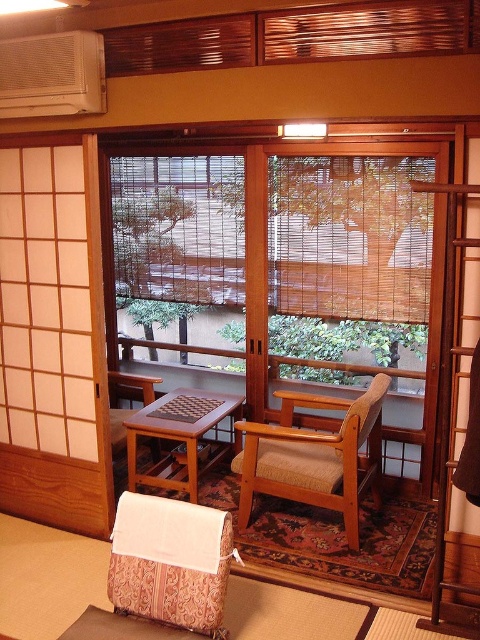
You are sitting on the wooden armchair at left and want to place a tall vase on the woodenobject at center. Can the vase fit on top of it?

The woodenobject at center has a greater height compared to wooden armchair at left. Therefore, the tall vase can be placed on top of the woodenobject at center since it is taller than the wooden armchair at left.

You are a visitor in this Japanese room and want to sit down. The wooden woven armchair at center and the white plastic air conditioner at upper left are in view. Which object is taller?

The wooden woven armchair at center is taller than the white plastic air conditioner at upper left according to the description.

You are a guest entering this traditional Japanese room and need to sit down. You see the wooden woven armchair at center and the woodenobject at center. Which one is taller and thus more suitable for someone who prefers a higher seat?

The wooden woven armchair at center is taller than the woodenobject at center, so it is more suitable for someone who prefers a higher seat.